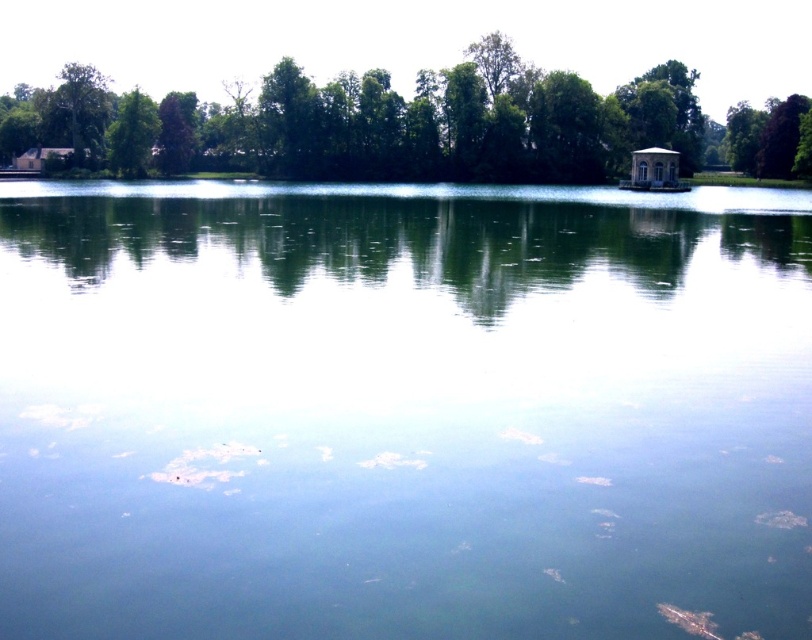
Does clear water at center appear over green leafy tree at upper left?

Incorrect, clear water at center is not positioned above green leafy tree at upper left.

What do you see at coordinates (402, 412) in the screenshot? The width and height of the screenshot is (812, 640). I see `clear water at center` at bounding box center [402, 412].

The width and height of the screenshot is (812, 640). Identify the location of clear water at center. (402, 412).

Where is `clear water at center`? Image resolution: width=812 pixels, height=640 pixels. clear water at center is located at coordinates (402, 412).

Which is more to the right, clear water at center or green leafy tree at left?

clear water at center is more to the right.

Can you confirm if clear water at center is positioned above green leafy tree at left?

No, clear water at center is not above green leafy tree at left.

Who is more distant from viewer, (111, 547) or (124, 106)?

Positioned behind is point (124, 106).

I want to click on clear water at center, so click(402, 412).

Is the position of green leafy tree at upper center less distant than that of green leafy tree at left?

Yes, green leafy tree at upper center is closer to the viewer.

Which of these two, green leafy tree at upper center or green leafy tree at left, stands shorter?

Standing shorter between the two is green leafy tree at left.

This screenshot has width=812, height=640. What are the coordinates of `green leafy tree at upper center` in the screenshot? It's located at (435, 124).